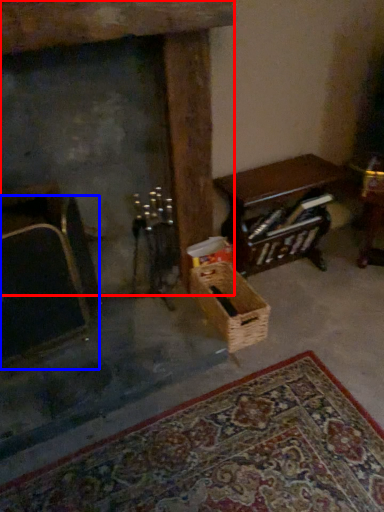
Question: Which point is further to the camera, fireplace (highlighted by a red box) or armchair (highlighted by a blue box)?

Choices:
 (A) fireplace
 (B) armchair

Answer: (B)